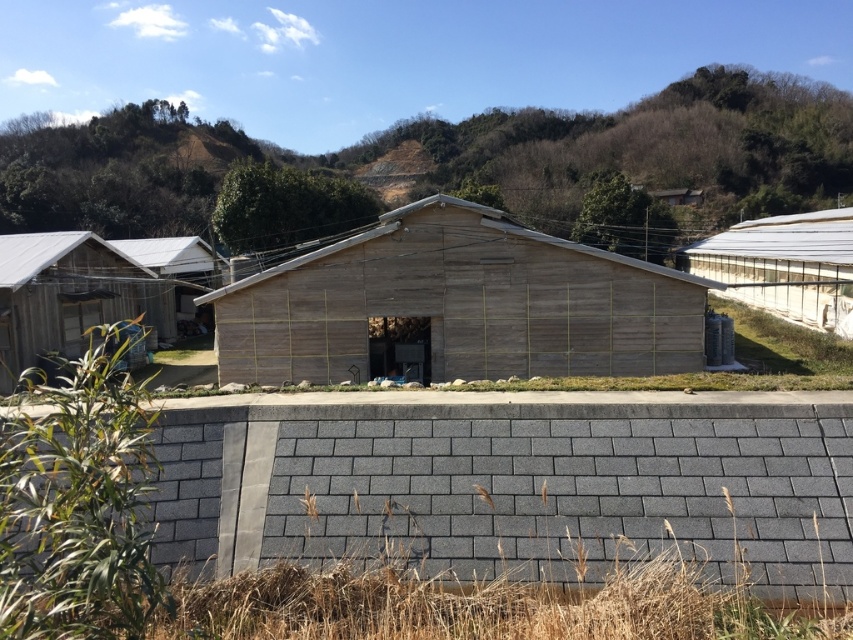
Which is more to the right, wooden hut at left or transparent plastic greenhouse at right?

Positioned to the right is transparent plastic greenhouse at right.

Between wooden hut at left and transparent plastic greenhouse at right, which one appears on the left side from the viewer's perspective?

Positioned to the left is wooden hut at left.

Who is more forward, (73, 280) or (802, 262)?

Point (73, 280)

You are a GUI agent. You are given a task and a screenshot of the screen. Output one action in this format:
    pyautogui.click(x=<x>, y=<y>)
    Task: Click on the wooden hut at left
    The image size is (853, 640).
    Given the screenshot: What is the action you would take?
    pyautogui.click(x=67, y=296)

Does green leafy hillside at upper center have a greater height compared to wooden hut at left?

Yes.

Can you confirm if green leafy hillside at upper center is positioned to the left of wooden hut at left?

In fact, green leafy hillside at upper center is to the right of wooden hut at left.

Is point (20, 202) more distant than point (10, 241)?

Yes, point (20, 202) is behind point (10, 241).

Where is `green leafy hillside at upper center`? The width and height of the screenshot is (853, 640). green leafy hillside at upper center is located at coordinates (444, 166).

Based on the photo, who is shorter, wooden hut at center or transparent plastic greenhouse at right?

wooden hut at center

Between wooden hut at center and transparent plastic greenhouse at right, which one appears on the left side from the viewer's perspective?

Positioned to the left is wooden hut at center.

The width and height of the screenshot is (853, 640). In order to click on wooden hut at center in this screenshot , I will do [459, 304].

This screenshot has height=640, width=853. Identify the location of wooden hut at center. 459,304.